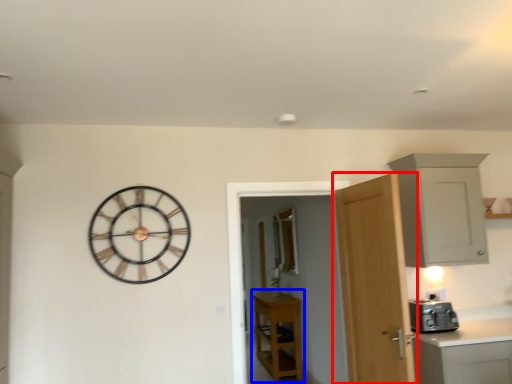
Question: Among these objects, which one is nearest to the camera, door (highlighted by a red box) or cabinetry (highlighted by a blue box)?

Choices:
 (A) door
 (B) cabinetry

Answer: (A)